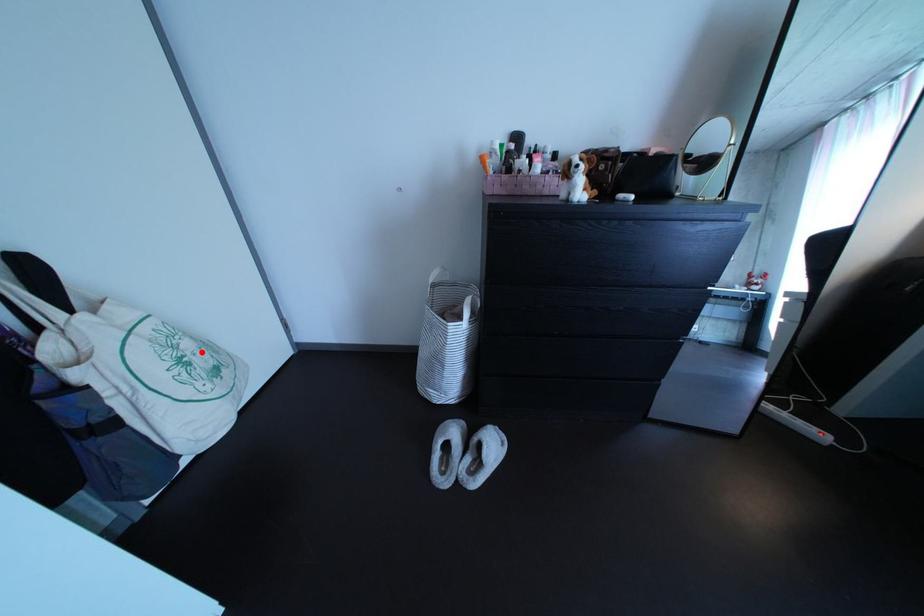
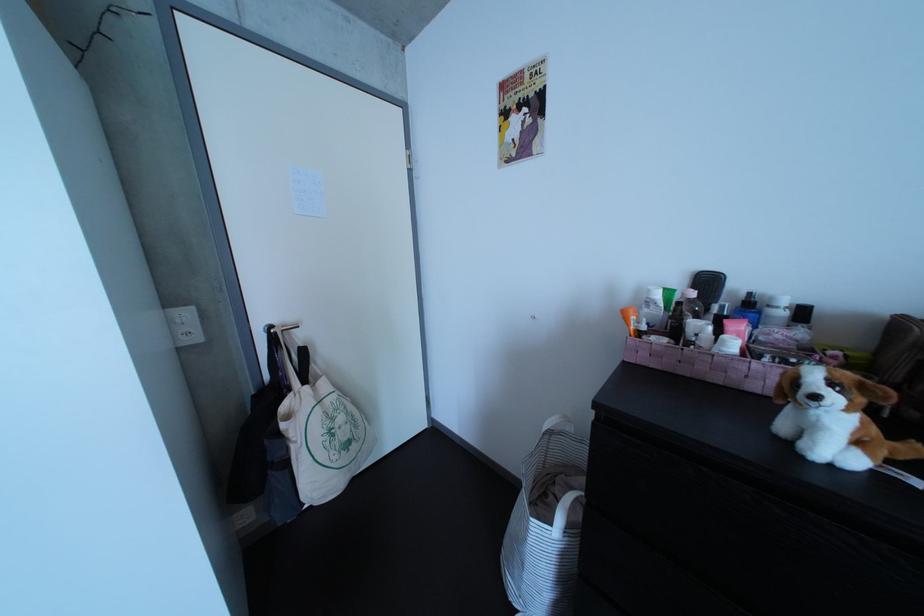
In the second image, find the point that corresponds to the highlighted location in the first image.

(355, 426)